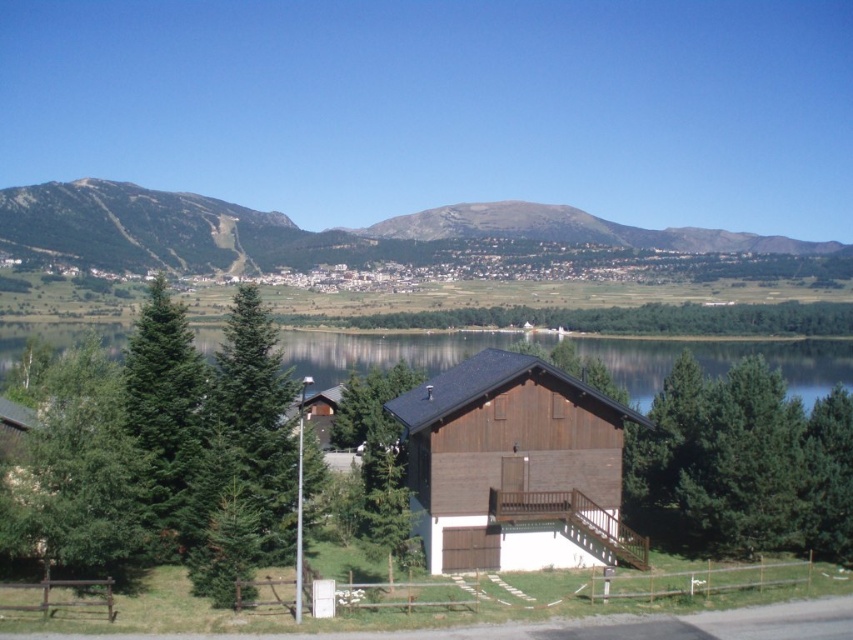
You are planning to build a small cabin near the transparent water at center. Considering the rugged brown mountain at upper left, will the mountain block the view of the water from your cabin? Please explain based on their heights.

The rugged brown mountain at upper left is taller than transparent water at center. Since the mountain is taller, it may block the view of the water from your cabin depending on the cabin location and elevation.

You are standing at the entrance of the wooden chalet and want to take a photo of the rugged brown mountain at upper left. Where should you position yourself to capture it in the frame?

To capture the rugged brown mountain at upper left in the frame, position yourself at the entrance of the wooden chalet and aim your camera towards the upper left direction, specifically at the coordinates point mentioned in the description.

You are standing at the entrance of the wooden chalet and want to take a photo of the rugged brown mountain at upper left. Based on its position, which direction should you face to capture it in your view?

The rugged brown mountain at upper left is located at point coordinates, so you should face the upper left direction to capture it in your view.